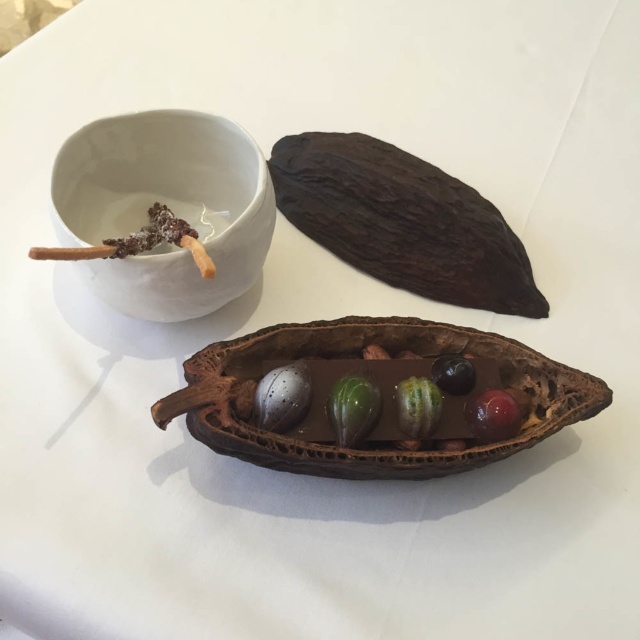
You are looking at the image of cocoa items on a white tablecloth. There are two points marked in the scene. Which point is closer to you, point (298,385) or point (509,410)?

Point (298,385) is further to the camera than point (509,410), so point (509,410) is closer to you.

You are a chef preparing a dessert platter. You have a white ceramic bowl at upper left and a green glossy chocolate at center. How far apart are these two items on the table?

The white ceramic bowl at upper left is 17.03 inches away from the green glossy chocolate at center.

You are standing 6 feet away from the cocoa pod. If you want to pick up the object at point (x=442, y=278), will you be able to reach it without moving closer?

The object at point (x=442, y=278) is 4.75 feet from the camera. Since you are standing 6 feet away from the cocoa pod, which is farther than 4.75 feet, you can reach it without moving closer.